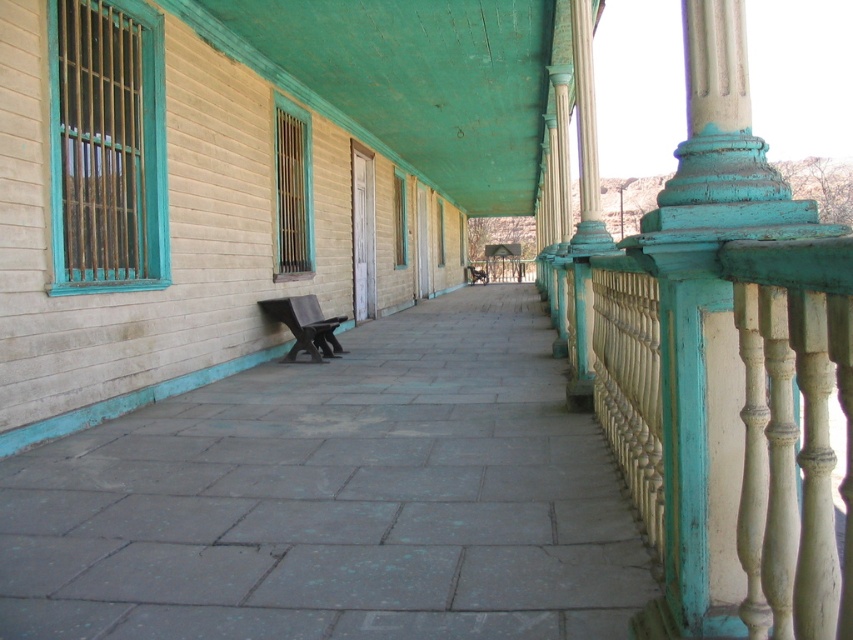
Question: Can you confirm if gray stone pavement at center is thinner than wooden park bench at center?

Choices:
 (A) no
 (B) yes

Answer: (A)

Question: Which point is closer to the camera?

Choices:
 (A) (317, 346)
 (B) (534, 387)

Answer: (B)

Question: Is gray stone pavement at center to the right of wooden park bench at center from the viewer's perspective?

Choices:
 (A) no
 (B) yes

Answer: (B)

Question: Which point is closer to the camera taking this photo?

Choices:
 (A) (138, 538)
 (B) (287, 320)

Answer: (A)

Question: Is gray stone pavement at center below wooden park bench at center?

Choices:
 (A) no
 (B) yes

Answer: (B)